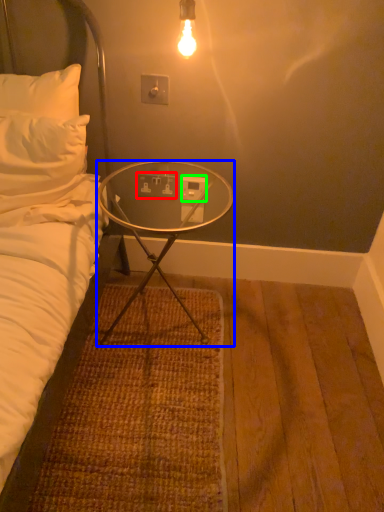
Question: Which is farther away from electric outlet (highlighted by a red box)? desk (highlighted by a blue box) or power outlet (highlighted by a green box)?

Choices:
 (A) desk
 (B) power outlet

Answer: (A)